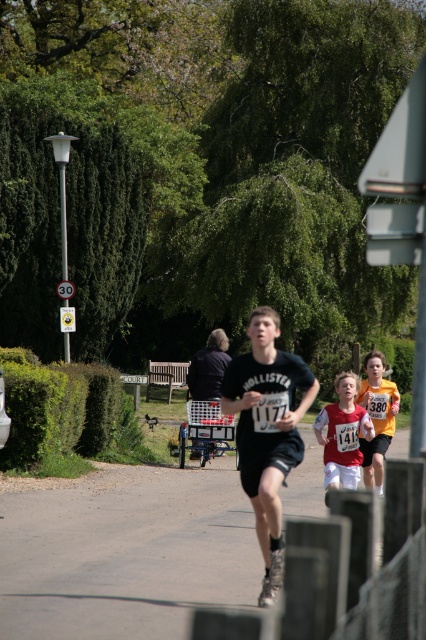
Between black matte t-shirt at center and matte black shirt at center, which one is positioned lower?

black matte t-shirt at center is lower down.

Is black matte t-shirt at center positioned in front of matte black shirt at center?

Yes, it is in front of matte black shirt at center.

You are a GUI agent. You are given a task and a screenshot of the screen. Output one action in this format:
    pyautogui.click(x=<x>, y=<y>)
    Task: Click on the black matte t-shirt at center
    The image size is (426, 640).
    Given the screenshot: What is the action you would take?
    pyautogui.click(x=267, y=432)

Identify the location of black matte t-shirt at center. pyautogui.click(x=267, y=432).

Is smooth asphalt road at center shorter than matte black shirt at center?

Correct, smooth asphalt road at center is not as tall as matte black shirt at center.

Does smooth asphalt road at center appear over matte black shirt at center?

Incorrect, smooth asphalt road at center is not positioned above matte black shirt at center.

In order to click on smooth asphalt road at center in this screenshot , I will do `click(123, 552)`.

Can you confirm if smooth asphalt road at center is wider than black matte t-shirt at center?

Indeed, smooth asphalt road at center has a greater width compared to black matte t-shirt at center.

Does smooth asphalt road at center come behind black matte t-shirt at center?

That is False.

Is point (45, 506) in front of point (259, 339)?

No, it is behind (259, 339).

Locate an element on the screen. This screenshot has height=640, width=426. smooth asphalt road at center is located at coordinates (123, 552).